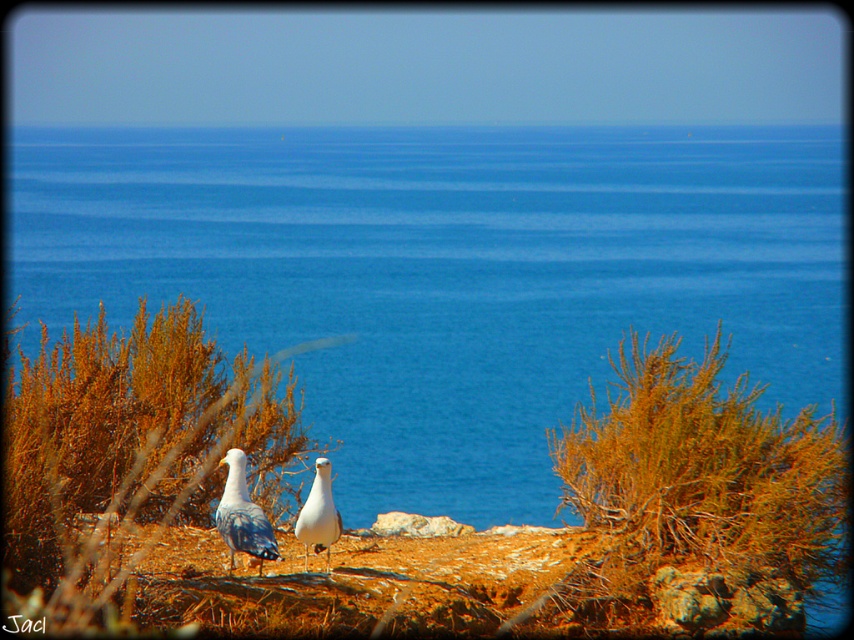
Is brown textured bush at center right closer to camera compared to white feathered seagull at lower center?

No, brown textured bush at center right is behind white feathered seagull at lower center.

Measure the distance between point (x=656, y=426) and camera.

A distance of 47.80 feet exists between point (x=656, y=426) and camera.

This screenshot has height=640, width=854. Identify the location of brown textured bush at center right. (706, 474).

Find the location of a particular element. brown textured bush at center right is located at coordinates pos(706,474).

Between blue water at center and white feathered bird at center, which one has more height?

Standing taller between the two is blue water at center.

Is point (18, 292) in front of point (320, 499)?

No.

Find the location of a particular element. The image size is (854, 640). blue water at center is located at coordinates (449, 275).

Is white feathered seagull at lower center above white feathered bird at center?

Yes.

Is point (241, 531) positioned before point (313, 490)?

Yes.

Who is more distant from viewer, (231, 467) or (317, 529)?

Positioned behind is point (231, 467).

What are the coordinates of `white feathered seagull at lower center` in the screenshot? It's located at (243, 515).